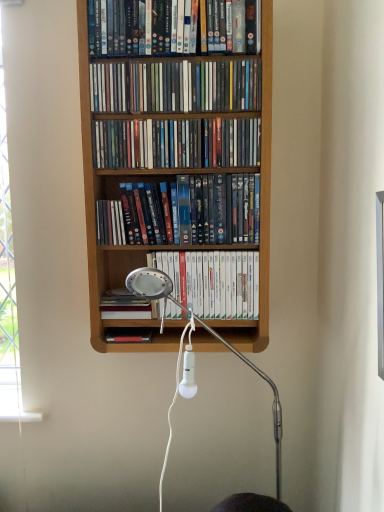
Question: Is matte plastic dvds at upper center, which appears as the 1th book when viewed from the top, positioned in front of wooden shelf at upper center, placed as the second book when sorted from top to bottom?

Choices:
 (A) no
 (B) yes

Answer: (B)

Question: Is matte plastic dvds at upper center, which appears as the 1th book when viewed from the top, positioned far away from wooden shelf at upper center, the 5th book ordered from the bottom?

Choices:
 (A) no
 (B) yes

Answer: (A)

Question: Considering the relative sizes of matte plastic dvds at upper center, which is the sixth book in bottom-to-top order, and wooden shelf at upper center, placed as the second book when sorted from top to bottom, in the image provided, is matte plastic dvds at upper center, which is the sixth book in bottom-to-top order, taller than wooden shelf at upper center, placed as the second book when sorted from top to bottom,?

Choices:
 (A) yes
 (B) no

Answer: (A)

Question: From the image's perspective, does matte plastic dvds at upper center, which is the sixth book in bottom-to-top order, appear lower than wooden shelf at upper center, placed as the second book when sorted from top to bottom?

Choices:
 (A) no
 (B) yes

Answer: (A)

Question: Is matte plastic dvds at upper center, which is the sixth book in bottom-to-top order, facing away from wooden shelf at upper center, the 5th book ordered from the bottom?

Choices:
 (A) yes
 (B) no

Answer: (B)

Question: Is matte plastic dvds at center, positioned as the 4th book in bottom-to-top order, situated inside matte plastic dvds at upper center, which appears as the 1th book when viewed from the top, or outside?

Choices:
 (A) outside
 (B) inside

Answer: (A)

Question: Considering the positions of matte plastic dvds at center, acting as the third book starting from the top, and matte plastic dvds at upper center, which appears as the 1th book when viewed from the top, in the image, is matte plastic dvds at center, acting as the third book starting from the top, wider or thinner than matte plastic dvds at upper center, which appears as the 1th book when viewed from the top,?

Choices:
 (A) thin
 (B) wide

Answer: (A)

Question: Is matte plastic dvds at center, acting as the third book starting from the top, to the left or to the right of matte plastic dvds at upper center, which is the sixth book in bottom-to-top order, in the image?

Choices:
 (A) left
 (B) right

Answer: (B)

Question: Considering the positions of matte plastic dvds at center, acting as the third book starting from the top, and matte plastic dvds at upper center, which appears as the 1th book when viewed from the top, in the image, is matte plastic dvds at center, acting as the third book starting from the top, taller or shorter than matte plastic dvds at upper center, which appears as the 1th book when viewed from the top,?

Choices:
 (A) tall
 (B) short

Answer: (B)

Question: Is hardcover book at center, which appears as the 1th book when ordered from the bottom, taller or shorter than matte plastic dvds at upper center, which appears as the 1th book when viewed from the top?

Choices:
 (A) tall
 (B) short

Answer: (B)

Question: Looking at their shapes, would you say hardcover book at center, the sixth book from the top, is wider or thinner than matte plastic dvds at upper center, which appears as the 1th book when viewed from the top?

Choices:
 (A) wide
 (B) thin

Answer: (B)

Question: Would you say hardcover book at center, which appears as the 1th book when ordered from the bottom, is to the left or to the right of matte plastic dvds at upper center, which appears as the 1th book when viewed from the top, in the picture?

Choices:
 (A) left
 (B) right

Answer: (A)

Question: Based on their sizes in the image, would you say hardcover book at center, the sixth book from the top, is bigger or smaller than matte plastic dvds at upper center, which is the sixth book in bottom-to-top order?

Choices:
 (A) small
 (B) big

Answer: (A)

Question: From the image's perspective, is matte plastic dvds at upper center, which appears as the 1th book when viewed from the top, located above or below hardcover book at center, the sixth book from the top?

Choices:
 (A) above
 (B) below

Answer: (A)

Question: Is matte plastic dvds at upper center, which appears as the 1th book when viewed from the top, wider or thinner than hardcover book at center, which appears as the 1th book when ordered from the bottom?

Choices:
 (A) thin
 (B) wide

Answer: (B)